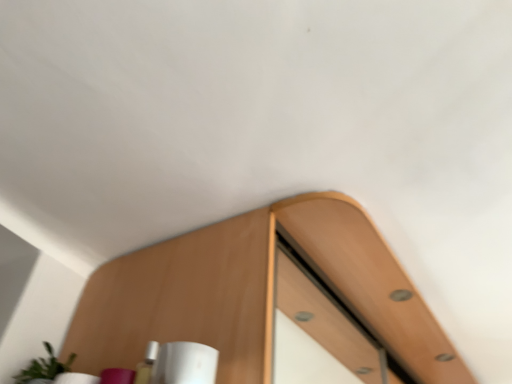
At what (x,y) coordinates should I click in order to perform the action: click on green leafy plant at lower left. Please return your answer as a coordinate pair (x, y). Looking at the image, I should click on (44, 367).

The width and height of the screenshot is (512, 384). What do you see at coordinates (44, 367) in the screenshot?
I see `green leafy plant at lower left` at bounding box center [44, 367].

At what (x,y) coordinates should I click in order to perform the action: click on green leafy plant at lower left. Please return your answer as a coordinate pair (x, y). The height and width of the screenshot is (384, 512). Looking at the image, I should click on (44, 367).